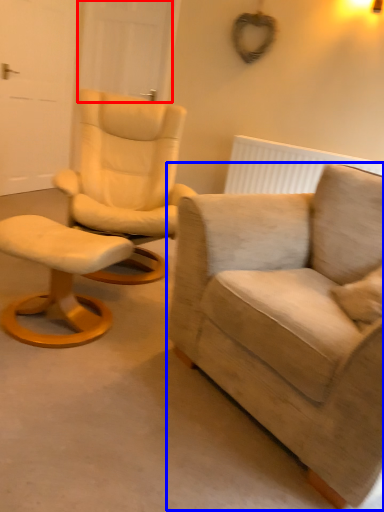
Question: Which object appears closest to the camera in this image, door (highlighted by a red box) or chair (highlighted by a blue box)?

Choices:
 (A) door
 (B) chair

Answer: (B)